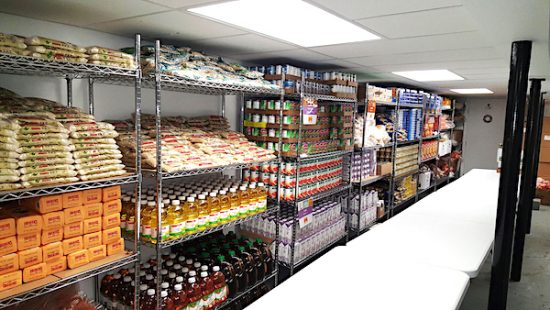
The image size is (550, 310). In order to click on floor in this screenshot , I will do `click(529, 287)`.